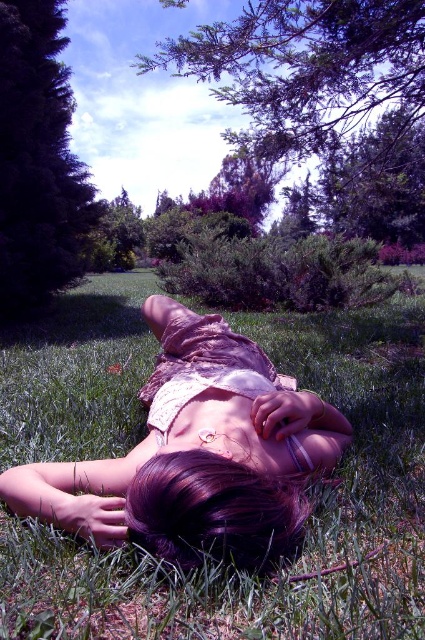
Does pink lace dress at center have a smaller size compared to dark purple hair at center?

No, pink lace dress at center is not smaller than dark purple hair at center.

What do you see at coordinates (198, 454) in the screenshot? I see `pink lace dress at center` at bounding box center [198, 454].

The width and height of the screenshot is (425, 640). Identify the location of pink lace dress at center. 198,454.